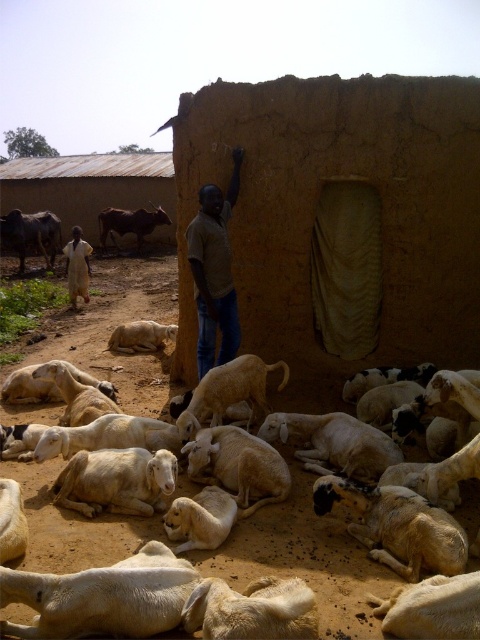
You are a shepherd trying to count your animals. You see the white woolen sheep at center and the white woolen goat at lower left. Which animal is positioned more to the right side of the scene?

The white woolen sheep at center is positioned more to the right side of the scene compared to the white woolen goat at lower left.

You are a shepherd who wants to separate the white woolen sheep at center from the white woolen goat at lower left. Which animal should you move upwards to achieve this?

The white woolen sheep at center is below the white woolen goat at lower left, so you should move the white woolen sheep at center upwards to be above the white woolen goat at lower left.